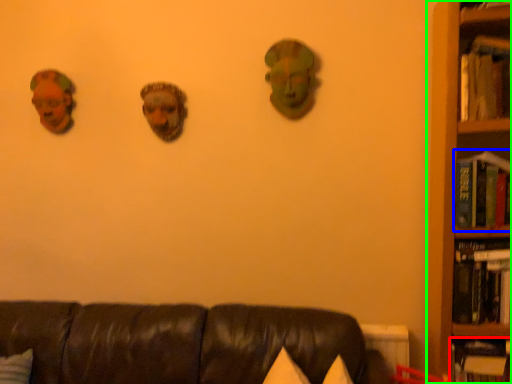
Question: Which is farther away from book (highlighted by a red box)? book (highlighted by a blue box) or bookcase (highlighted by a green box)?

Choices:
 (A) book
 (B) bookcase

Answer: (A)